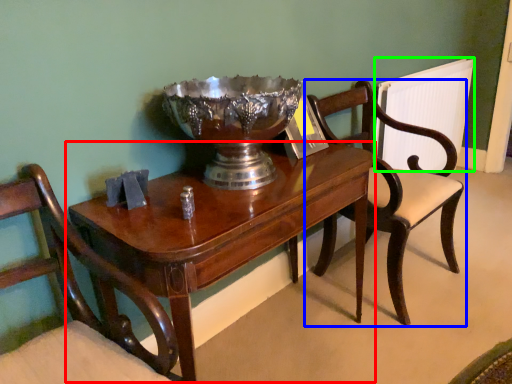
Question: Which object is positioned farthest from table (highlighted by a red box)? Select from chair (highlighted by a blue box) and radiator (highlighted by a green box).

Choices:
 (A) chair
 (B) radiator

Answer: (B)